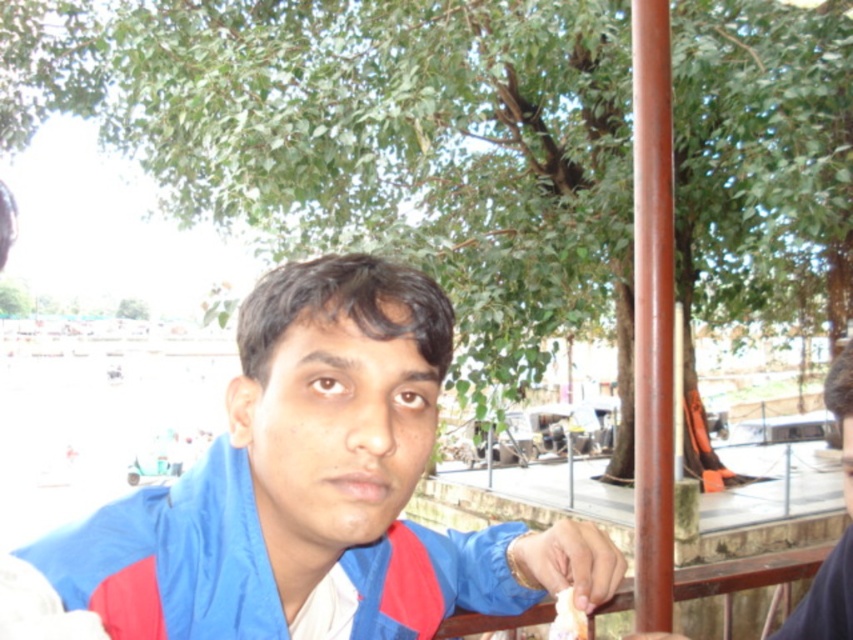
Is point (332, 476) more distant than point (573, 621)?

No.

The image size is (853, 640). Identify the location of blue fabric jacket at center. (308, 492).

In order to click on blue fabric jacket at center in this screenshot , I will do `click(308, 492)`.